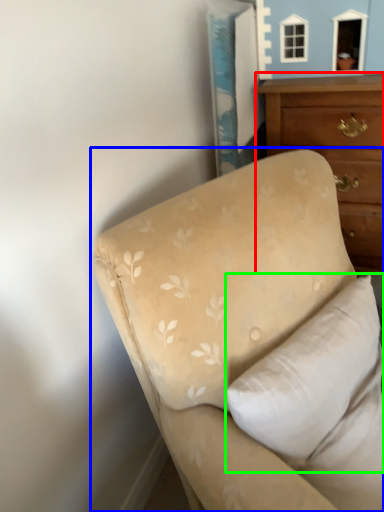
Question: Which object is the farthest from chest of drawers (highlighted by a red box)? Choose among these: studio couch (highlighted by a blue box) or pillow (highlighted by a green box).

Choices:
 (A) studio couch
 (B) pillow

Answer: (B)